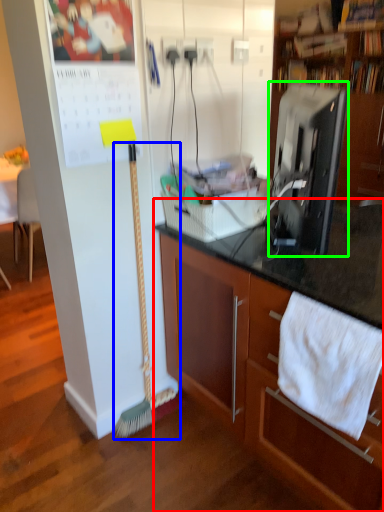
Question: Which object is positioned closest to cabinetry (highlighted by a red box)? Select from brush (highlighted by a blue box) and desktop computer (highlighted by a green box).

Choices:
 (A) brush
 (B) desktop computer

Answer: (B)